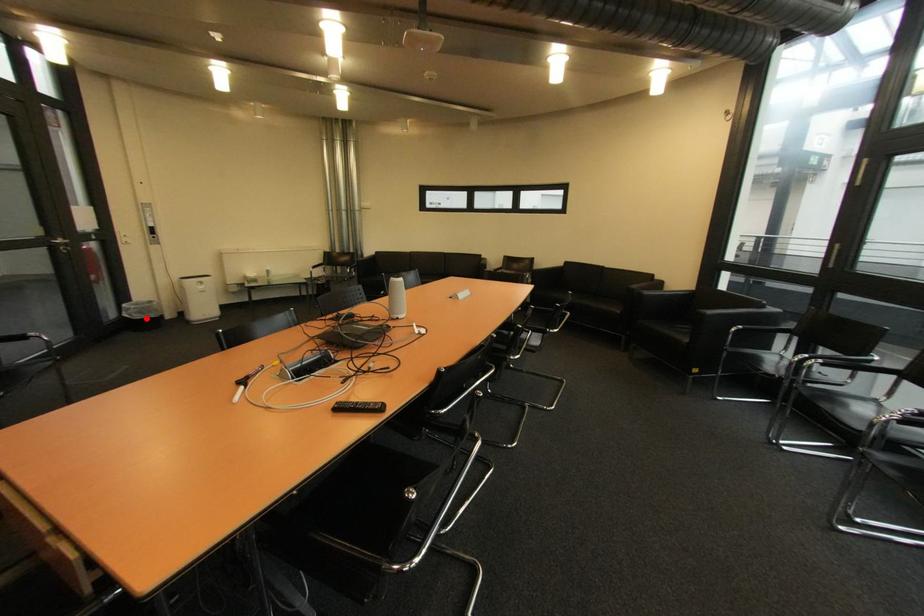
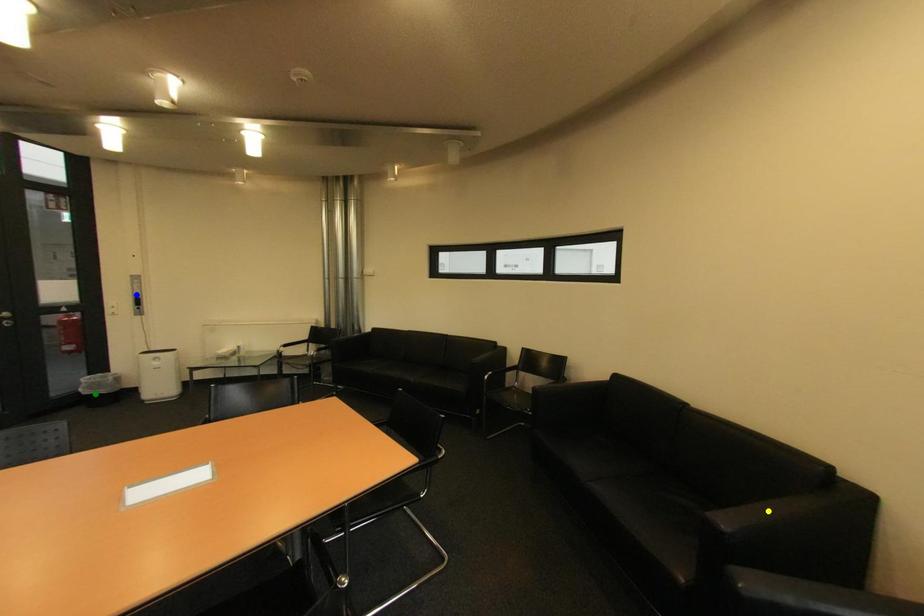
Question: I am providing you with two images of the same scene from different viewpoints. A red point is marked on the first image. You are given multiple points on the second image. Which point in image 2 represents the same 3d spot as the red point in image 1?

Choices:
 (A) yellow point
 (B) green point
 (C) blue point

Answer: (B)